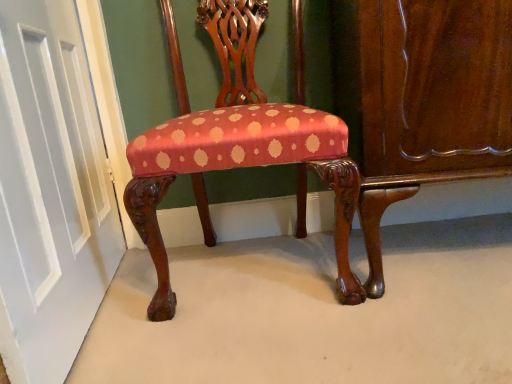
Find the location of a particular element. This screenshot has width=512, height=384. vacant area that lies between white painted wood door at left and silky red fabric chair at center is located at coordinates (170, 325).